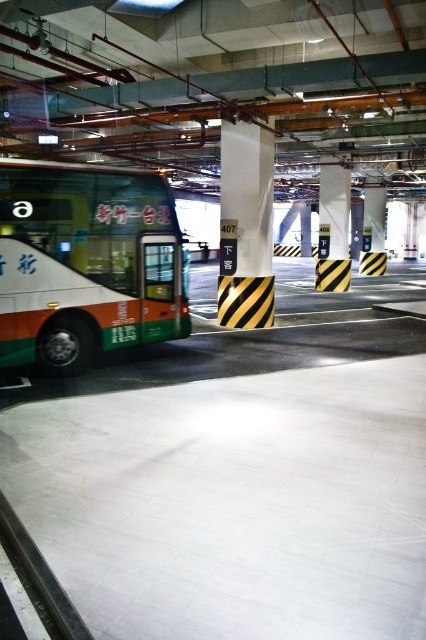
Question: Is white glossy bus at left wider than yellow/black striped pillar at center?

Choices:
 (A) no
 (B) yes

Answer: (B)

Question: Where is white glossy bus at left located in relation to yellow/black striped pillar at center in the image?

Choices:
 (A) left
 (B) right

Answer: (A)

Question: Which object is closer to the camera taking this photo?

Choices:
 (A) white glossy bus at left
 (B) black striped pillar at center
 (C) yellow/black striped pillar at center

Answer: (A)

Question: Which of the following is the farthest from the observer?

Choices:
 (A) yellow/black striped pillar at center
 (B) white glossy bus at left
 (C) black striped pillar at center

Answer: (A)

Question: Can you confirm if white glossy bus at left is positioned to the left of black striped pillar at center?

Choices:
 (A) no
 (B) yes

Answer: (B)

Question: Based on their relative distances, which object is farther from the black striped pillar at center?

Choices:
 (A) yellow/black striped pillar at center
 (B) white glossy bus at left

Answer: (A)